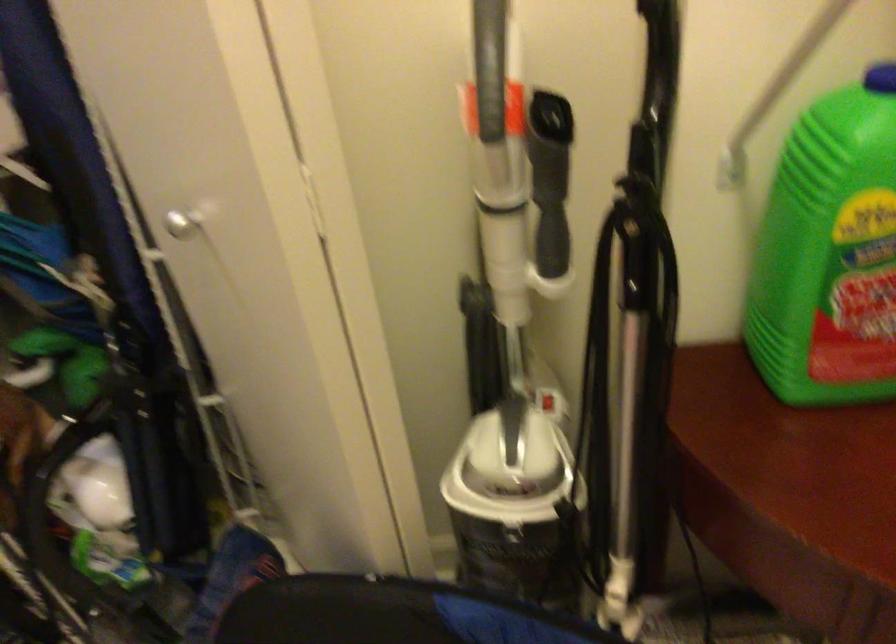
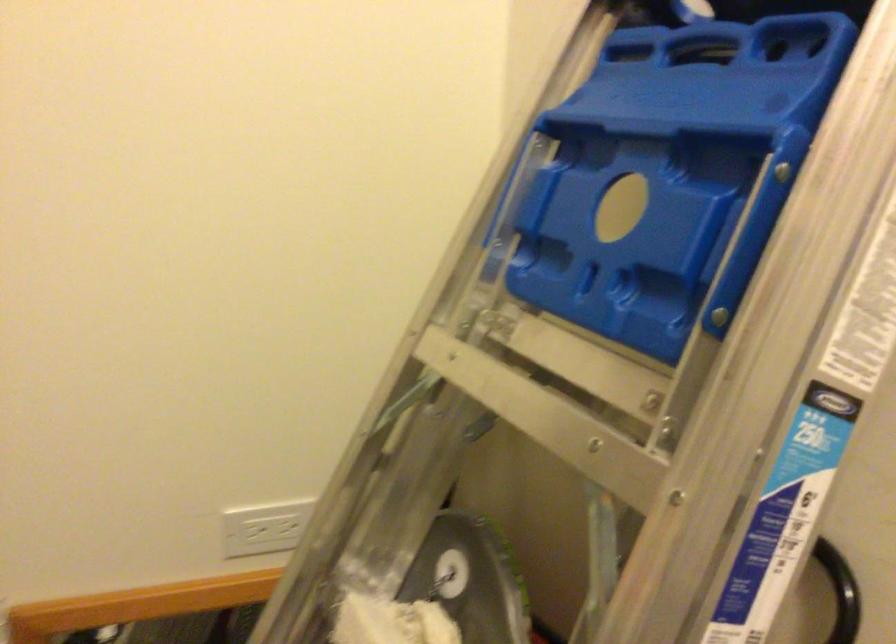
How did the camera likely rotate?

The camera's rotation is toward right-down.